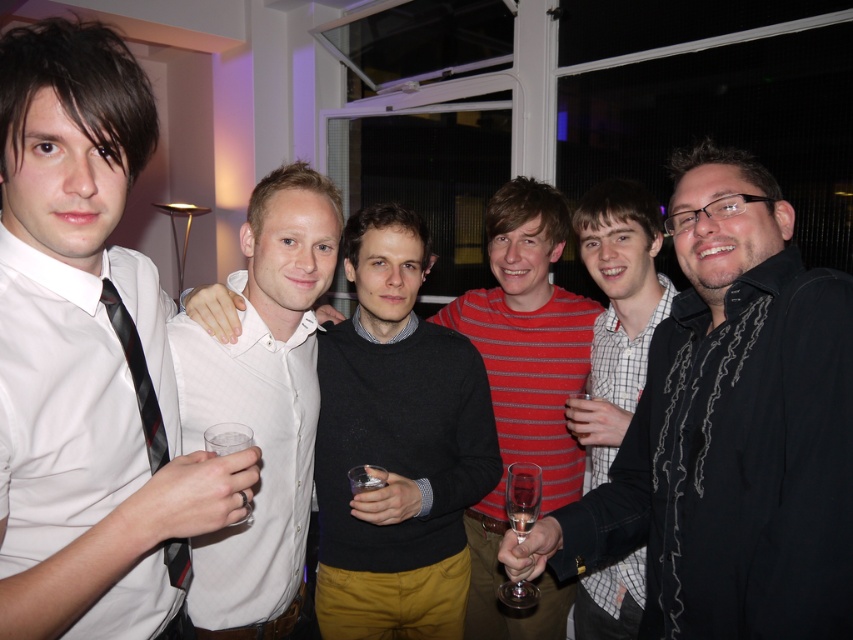
Question: Does white shirt at center appear on the right side of checkered shirt at center?

Choices:
 (A) yes
 (B) no

Answer: (B)

Question: Does white shirt at left appear on the left side of black striped tie at left?

Choices:
 (A) no
 (B) yes

Answer: (B)

Question: Among these objects, which one is farthest from the camera?

Choices:
 (A) black sweater at center
 (B) black textured shirt at center
 (C) black striped tie at left
 (D) striped cotton shirt at center

Answer: (D)

Question: Which point is farther to the camera?

Choices:
 (A) (32, 294)
 (B) (544, 291)
 (C) (595, 580)

Answer: (B)

Question: Can you confirm if white shirt at left is positioned to the right of checkered shirt at center?

Choices:
 (A) no
 (B) yes

Answer: (A)

Question: Which point is closer to the camera taking this photo?

Choices:
 (A) (606, 198)
 (B) (117, 454)
 (C) (807, 422)

Answer: (C)